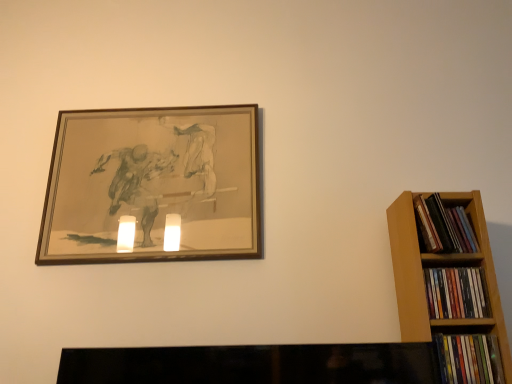
Question: Is point (444, 243) closer or farther from the camera than point (481, 382)?

Choices:
 (A) farther
 (B) closer

Answer: (A)

Question: Choose the correct answer: Is multicolored paperbacks at right, placed as the first book when sorted from top to bottom, inside multicolored plastic books at right, which is the third book in top-to-bottom order, or outside it?

Choices:
 (A) outside
 (B) inside

Answer: (A)

Question: Estimate the real-world distances between objects in this image. Which object is farther from the multicolored plastic books at right, which is the third book in top-to-bottom order?

Choices:
 (A) multicolored paperbacks at right, arranged as the second book when viewed from the top
 (B) wooden picture frame at upper left
 (C) multicolored paperbacks at right, the third book ordered from the bottom

Answer: (B)

Question: Which object is positioned closest to the multicolored paperbacks at right, the second book in the bottom-to-top sequence?

Choices:
 (A) multicolored plastic books at right, which is the third book in top-to-bottom order
 (B) wooden picture frame at upper left
 (C) multicolored paperbacks at right, placed as the first book when sorted from top to bottom

Answer: (A)